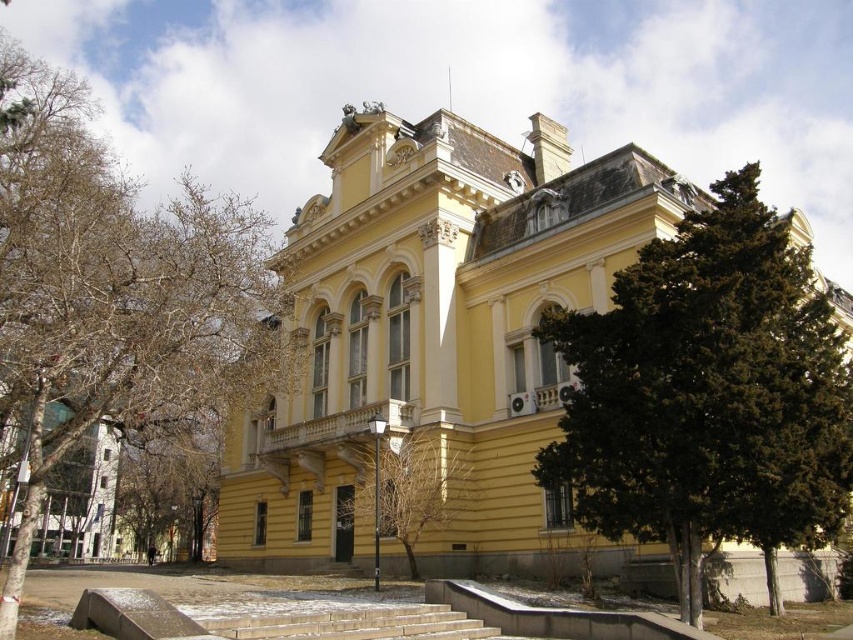
Is dark green coniferous tree at right smaller than bare branches at left?

Correct, dark green coniferous tree at right occupies less space than bare branches at left.

Does dark green coniferous tree at right have a greater height compared to bare branches at left?

In fact, dark green coniferous tree at right may be shorter than bare branches at left.

Is point (621, 291) farther from camera compared to point (140, 257)?

No.

You are a GUI agent. You are given a task and a screenshot of the screen. Output one action in this format:
    pyautogui.click(x=<x>, y=<y>)
    Task: Click on the dark green coniferous tree at right
    
    Given the screenshot: What is the action you would take?
    pyautogui.click(x=708, y=396)

Is point (393, 288) positioned after point (397, 474)?

Yes, point (393, 288) is behind point (397, 474).

Between yellow painted wood palace at center and green leafy tree at center, which one appears on the left side from the viewer's perspective?

green leafy tree at center

Who is more forward, (315, 330) or (413, 577)?

Positioned in front is point (413, 577).

Identify the location of yellow painted wood palace at center. (434, 337).

Is yellow painted wood palace at center below bare branches at left?

Yes, yellow painted wood palace at center is below bare branches at left.

Between point (437, 216) and point (51, 211), which one is positioned behind?

Point (51, 211)

Between point (485, 138) and point (93, 160), which one is positioned in front?

Positioned in front is point (485, 138).

Where is `yellow painted wood palace at center`? The width and height of the screenshot is (853, 640). yellow painted wood palace at center is located at coordinates (434, 337).